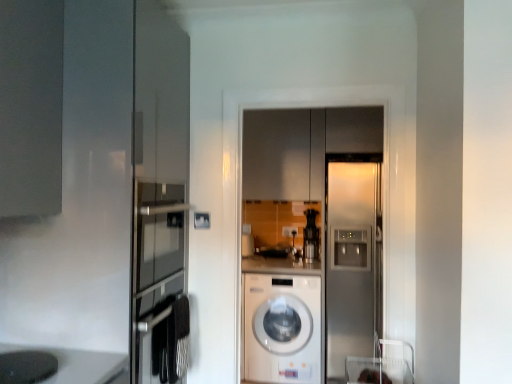
Question: In terms of width, does matte black coffee maker at lower left look wider or thinner when compared to white plastic electric outlet at center?

Choices:
 (A) wide
 (B) thin

Answer: (A)

Question: Relative to white plastic electric outlet at center, is matte black coffee maker at lower left in front or behind?

Choices:
 (A) behind
 (B) front

Answer: (B)

Question: Which of these objects is positioned farthest from the black plastic coffee machine at center?

Choices:
 (A) satin silver refrigerator at center
 (B) matte gray cabinet at center
 (C) white glossy washing machine at center
 (D) matte black coffee maker at lower left
 (E) white plastic electric outlet at center

Answer: (D)

Question: Considering the real-world distances, which object is farthest from the matte gray cabinet at center?

Choices:
 (A) white glossy washing machine at center
 (B) white plastic electric outlet at center
 (C) satin silver refrigerator at center
 (D) matte black coffee maker at lower left
 (E) black plastic coffee machine at center

Answer: (D)